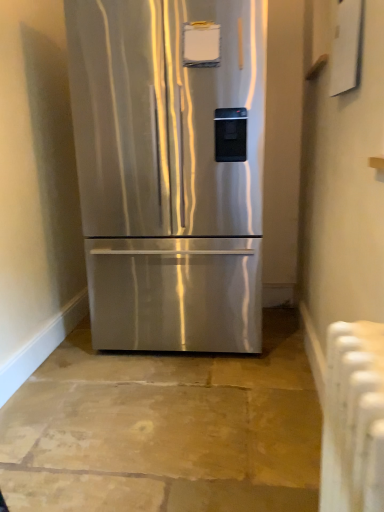
Question: Is stainless steel refrigerator at center to the left or to the right of white plastic radiator at lower right in the image?

Choices:
 (A) left
 (B) right

Answer: (A)

Question: Based on their sizes in the image, would you say stainless steel refrigerator at center is bigger or smaller than white plastic radiator at lower right?

Choices:
 (A) big
 (B) small

Answer: (A)

Question: Is stainless steel refrigerator at center wider or thinner than white plastic radiator at lower right?

Choices:
 (A) thin
 (B) wide

Answer: (B)

Question: Considering the positions of white plastic radiator at lower right and stainless steel refrigerator at center in the image, is white plastic radiator at lower right bigger or smaller than stainless steel refrigerator at center?

Choices:
 (A) big
 (B) small

Answer: (B)

Question: Based on their positions, is white plastic radiator at lower right located to the left or right of stainless steel refrigerator at center?

Choices:
 (A) right
 (B) left

Answer: (A)

Question: Considering the positions of white plastic radiator at lower right and stainless steel refrigerator at center in the image, is white plastic radiator at lower right wider or thinner than stainless steel refrigerator at center?

Choices:
 (A) wide
 (B) thin

Answer: (B)

Question: From the image's perspective, is white plastic radiator at lower right positioned above or below stainless steel refrigerator at center?

Choices:
 (A) below
 (B) above

Answer: (A)